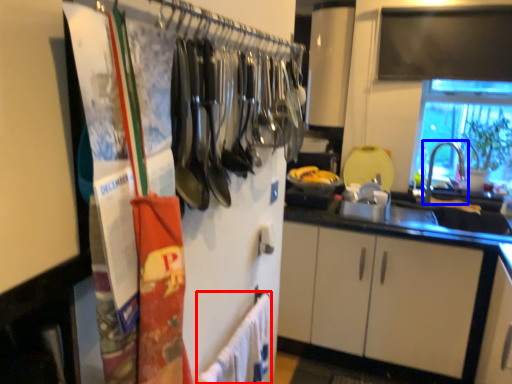
Question: Which object appears closest to the camera in this image, bath towel (highlighted by a red box) or faucet (highlighted by a blue box)?

Choices:
 (A) bath towel
 (B) faucet

Answer: (A)